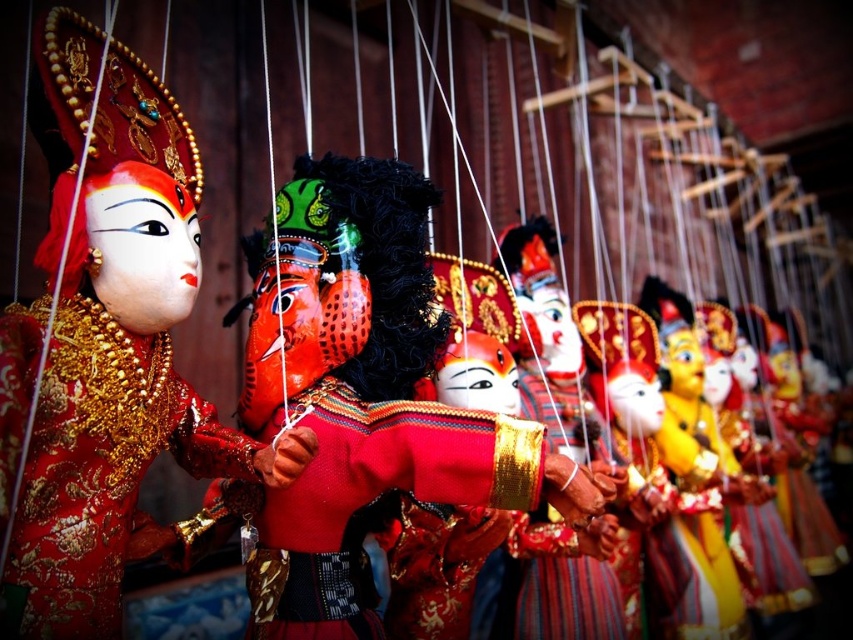
You are an art curator arranging a display of marionettes. You need to ensure that the matte gold mask at left and the velvet red costume at center are visible to visitors standing at the entrance. Considering their sizes, which object might require a closer placement to the entrance to ensure visibility?

The matte gold mask at left has a lesser width compared to the velvet red costume at center. To ensure visibility, the matte gold mask at left should be placed closer to the entrance so visitors can see it clearly.

You are an assistant organizing a puppet show and need to arrange the marionettes in order from left to right. Given the scene description, where is the matte red puppet at center positioned relative to the velvet red costume at center?

The matte red puppet at center is positioned to the left of the velvet red costume at center.